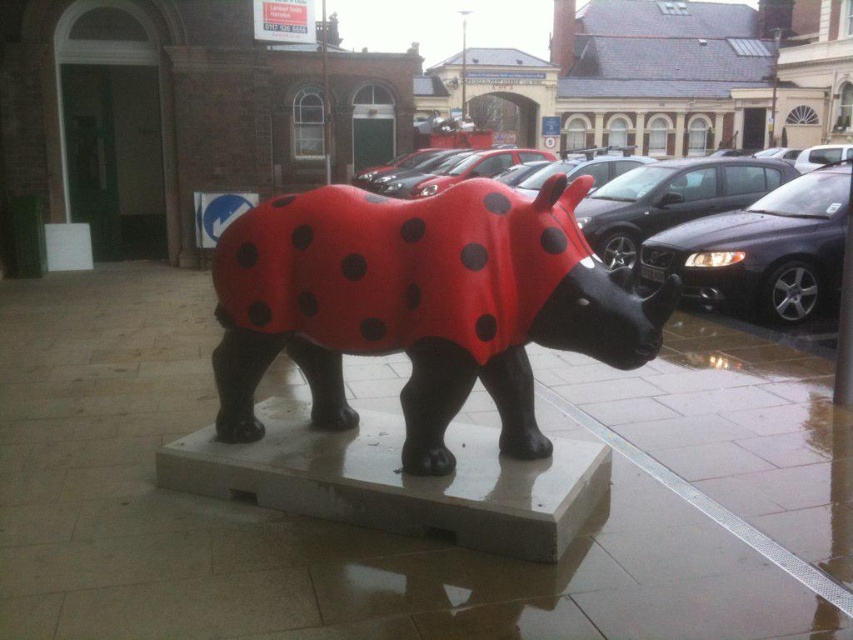
Does shiny black car at center have a greater height compared to matte black car at right?

No, shiny black car at center is not taller than matte black car at right.

Does shiny black car at center appear over matte black car at right?

Yes.

The height and width of the screenshot is (640, 853). What do you see at coordinates (730, 232) in the screenshot?
I see `shiny black car at center` at bounding box center [730, 232].

You are a GUI agent. You are given a task and a screenshot of the screen. Output one action in this format:
    pyautogui.click(x=<x>, y=<y>)
    Task: Click on the shiny black car at center
    The height and width of the screenshot is (640, 853).
    Given the screenshot: What is the action you would take?
    pyautogui.click(x=730, y=232)

Can you confirm if matte red rhino at center is bigger than matte black car at right?

Incorrect, matte red rhino at center is not larger than matte black car at right.

Who is positioned more to the right, matte red rhino at center or matte black car at right?

matte black car at right is more to the right.

Between point (347, 321) and point (730, 225), which one is positioned in front?

Point (347, 321) is in front.

Identify the location of matte red rhino at center. (421, 305).

Is point (405, 388) closer to viewer compared to point (834, 212)?

That is True.

Does matte red rhino at center have a larger size compared to shiny black car at center?

No.

Does point (625, 348) come behind point (814, 308)?

No, (625, 348) is closer to viewer.

You are a GUI agent. You are given a task and a screenshot of the screen. Output one action in this format:
    pyautogui.click(x=<x>, y=<y>)
    Task: Click on the matte red rhino at center
    This screenshot has width=853, height=640.
    Given the screenshot: What is the action you would take?
    [421, 305]